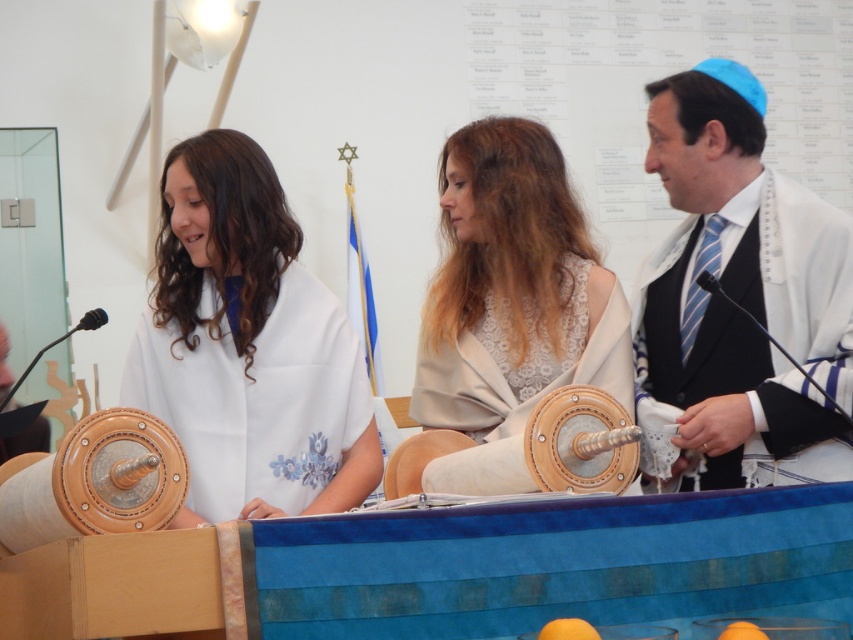
Find the location of a particular element. white matte shawl at center is located at coordinates (248, 346).

Does white matte shawl at center have a lesser height compared to lace fabric shawl at center?

Correct, white matte shawl at center is not as tall as lace fabric shawl at center.

Between point (193, 136) and point (457, 342), which one is positioned behind?

The point (457, 342) is more distant.

Find the location of a particular element. This screenshot has height=640, width=853. white matte shawl at center is located at coordinates (248, 346).

Who is lower down, white matte shawl at center or white textured robe at right?

Positioned lower is white textured robe at right.

Image resolution: width=853 pixels, height=640 pixels. What are the coordinates of `white matte shawl at center` in the screenshot? It's located at tap(248, 346).

In the scene shown: Is lace fabric shawl at center further to camera compared to white textured robe at right?

No, lace fabric shawl at center is closer to the viewer.

Which is above, lace fabric shawl at center or white textured robe at right?

→ white textured robe at right

Is point (585, 332) positioned in front of point (775, 465)?

No, it is not.

At what (x,y) coordinates should I click in order to perform the action: click on lace fabric shawl at center. Please return your answer as a coordinate pair (x, y). Looking at the image, I should click on (511, 301).